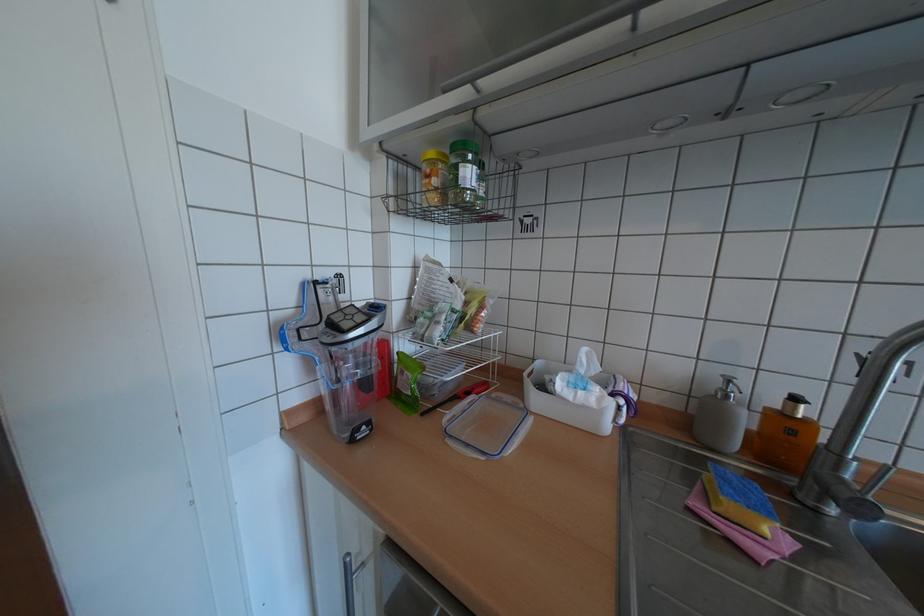
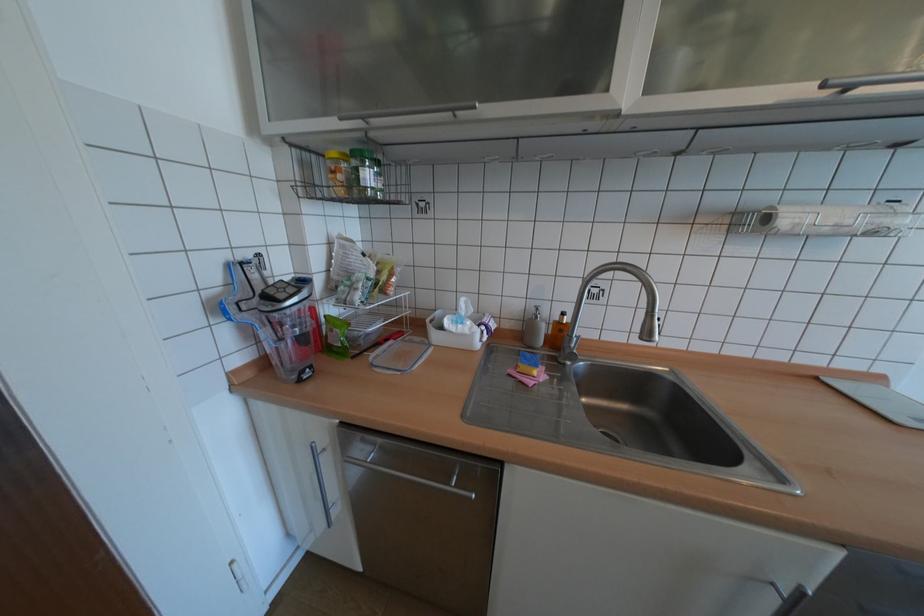
Where in the second image is the point corresponding to [831,508] from the first image?

(574, 363)